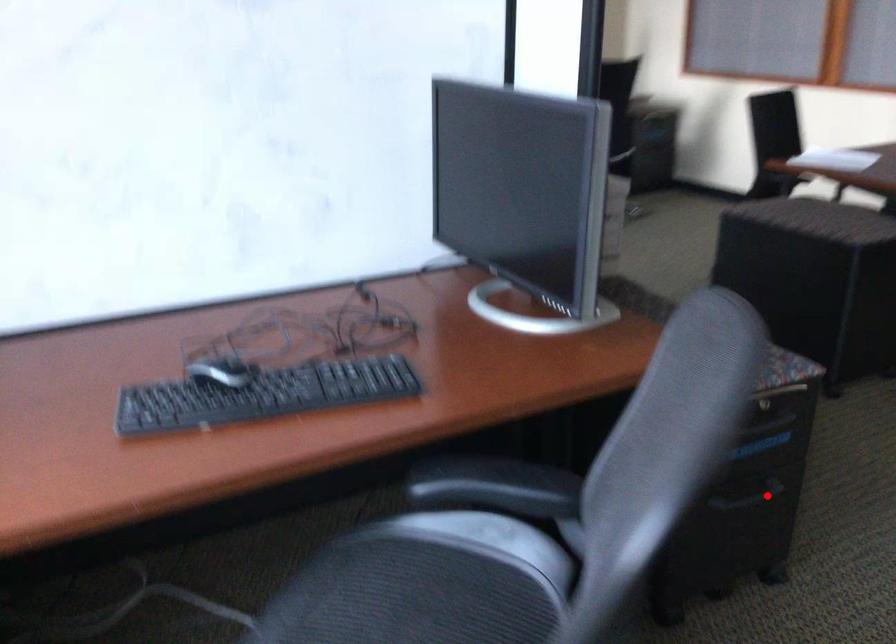
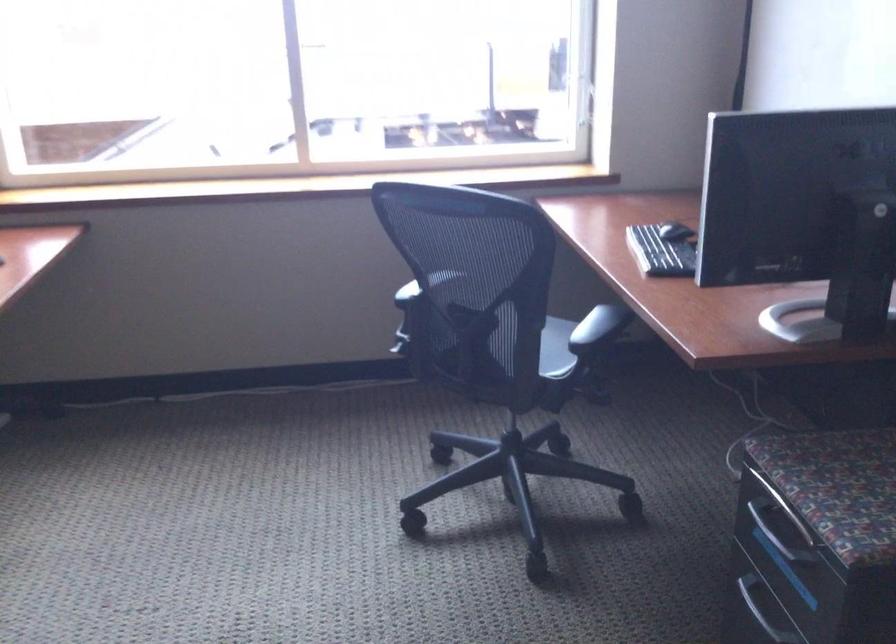
Question: I am providing you with two images of the same scene from different viewpoints. A red point is marked on the first image. Is the red point's position out of view in image 2?

Choices:
 (A) Yes
 (B) No

Answer: (B)